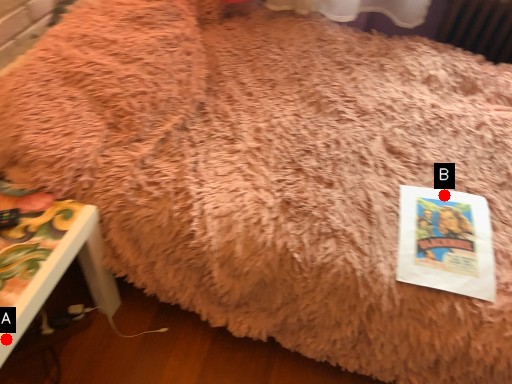
Question: Two points are circled on the image, labeled by A and B beside each circle. Among these points, which one is nearest to the camera?

Choices:
 (A) A is closer
 (B) B is closer

Answer: (A)